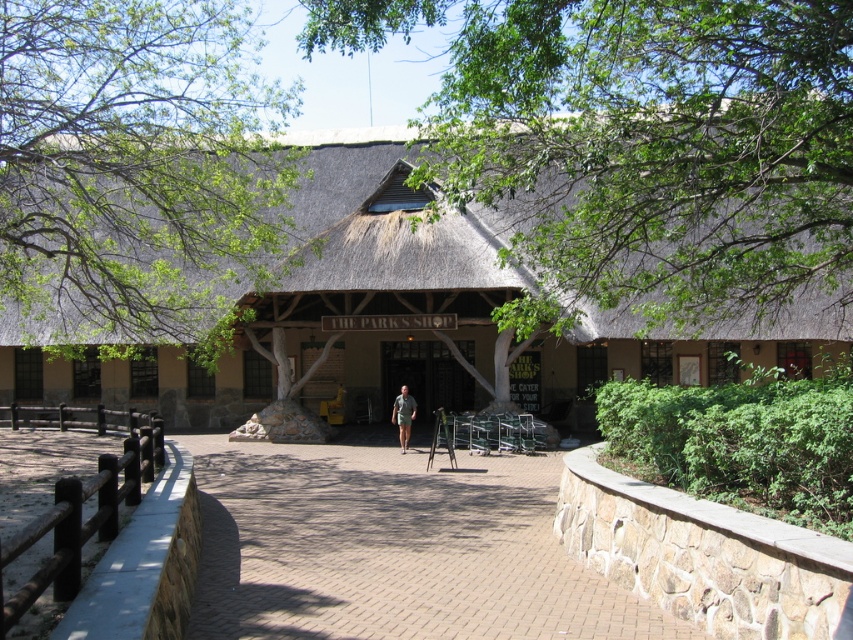
Question: Among these points, which one is nearest to the camera?

Choices:
 (A) (401, 426)
 (B) (44, 84)
 (C) (834, 147)

Answer: (C)

Question: Does green leafy tree at upper center lie behind green leafy tree at upper left?

Choices:
 (A) no
 (B) yes

Answer: (A)

Question: From the image, what is the correct spatial relationship of brown thatch hut at center in relation to camouflage fabric shirt at center?

Choices:
 (A) right
 (B) left

Answer: (B)

Question: Is brown brick path at center above brown thatch hut at center?

Choices:
 (A) yes
 (B) no

Answer: (B)

Question: Estimate the real-world distances between objects in this image. Which object is closer to the brown brick path at center?

Choices:
 (A) green leafy tree at upper center
 (B) brown thatch hut at center

Answer: (A)

Question: Which of the following is the farthest from the observer?

Choices:
 (A) camouflage fabric shirt at center
 (B) brown brick path at center

Answer: (A)